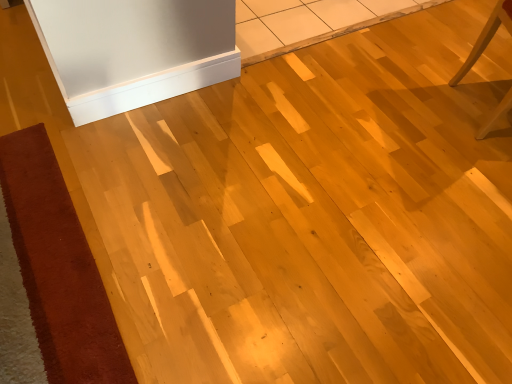
Question: Does velvet-like brown mat at lower left have a greater height compared to white glossy baseboard at upper center?

Choices:
 (A) no
 (B) yes

Answer: (A)

Question: From the image's perspective, does velvet-like brown mat at lower left appear lower than white glossy baseboard at upper center?

Choices:
 (A) no
 (B) yes

Answer: (B)

Question: Would you say velvet-like brown mat at lower left contains white glossy baseboard at upper center?

Choices:
 (A) no
 (B) yes

Answer: (A)

Question: Is velvet-like brown mat at lower left wider than white glossy baseboard at upper center?

Choices:
 (A) yes
 (B) no

Answer: (A)

Question: Is velvet-like brown mat at lower left to the left of white glossy baseboard at upper center from the viewer's perspective?

Choices:
 (A) no
 (B) yes

Answer: (B)

Question: Is point (92, 321) positioned closer to the camera than point (495, 112)?

Choices:
 (A) closer
 (B) farther

Answer: (A)

Question: Based on their sizes in the image, would you say velvet-like brown mat at lower left is bigger or smaller than light wood chair at right?

Choices:
 (A) small
 (B) big

Answer: (A)

Question: From the image's perspective, is velvet-like brown mat at lower left positioned above or below light wood chair at right?

Choices:
 (A) below
 (B) above

Answer: (A)

Question: In terms of width, does velvet-like brown mat at lower left look wider or thinner when compared to light wood chair at right?

Choices:
 (A) thin
 (B) wide

Answer: (B)

Question: From a real-world perspective, is white glossy baseboard at upper center above or below light wood chair at right?

Choices:
 (A) below
 (B) above

Answer: (A)

Question: Is white glossy baseboard at upper center to the left or to the right of light wood chair at right in the image?

Choices:
 (A) left
 (B) right

Answer: (A)

Question: Considering the positions of white glossy baseboard at upper center and light wood chair at right in the image, is white glossy baseboard at upper center taller or shorter than light wood chair at right?

Choices:
 (A) short
 (B) tall

Answer: (A)

Question: Looking at their shapes, would you say white glossy baseboard at upper center is wider or thinner than light wood chair at right?

Choices:
 (A) wide
 (B) thin

Answer: (B)

Question: From the image's perspective, is light wood chair at right above or below velvet-like brown mat at lower left?

Choices:
 (A) above
 (B) below

Answer: (A)

Question: Looking at their shapes, would you say light wood chair at right is wider or thinner than velvet-like brown mat at lower left?

Choices:
 (A) thin
 (B) wide

Answer: (A)